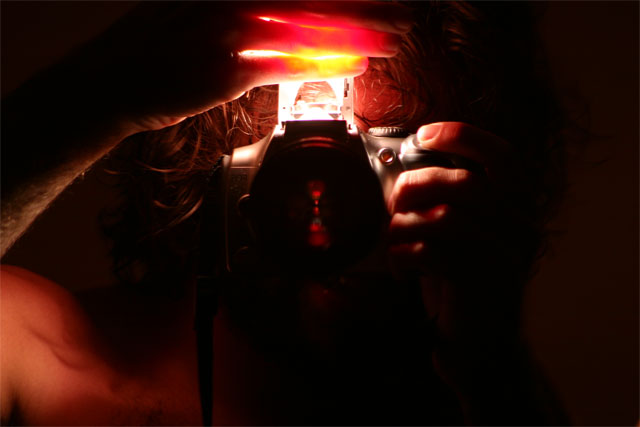
You are a GUI agent. You are given a task and a screenshot of the screen. Output one action in this format:
    pyautogui.click(x=<x>, y=<y>)
    Task: Click on the light
    The image size is (640, 427).
    Given the screenshot: What is the action you would take?
    316,105